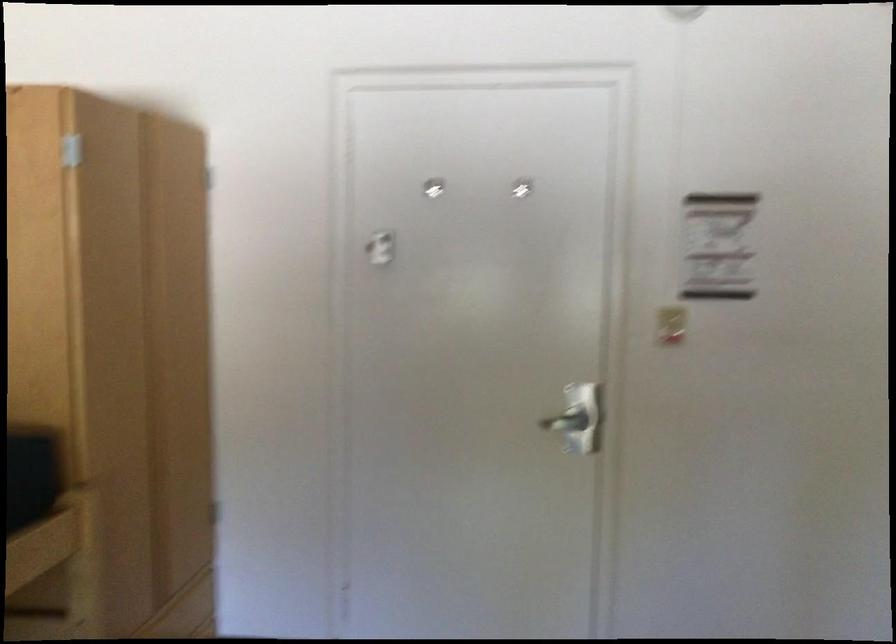
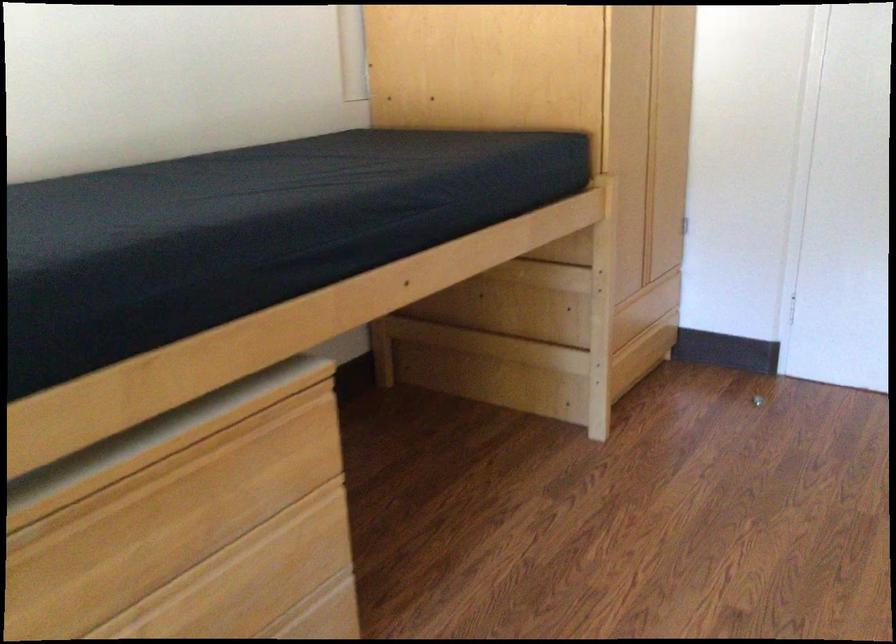
Find the pixel in the second image that matches point 158,444 in the first image.

(648, 160)